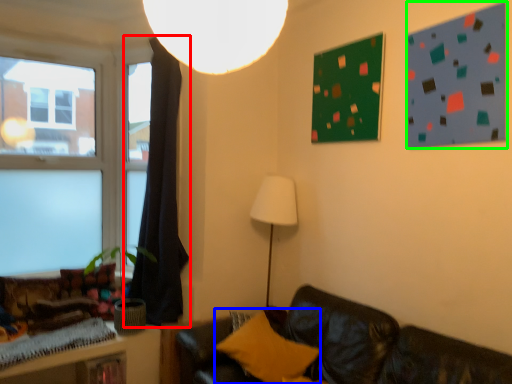
Question: Which object is positioned closest to curtain (highlighted by a red box)? Select from pillow (highlighted by a blue box) and bulletin board (highlighted by a green box).

Choices:
 (A) pillow
 (B) bulletin board

Answer: (A)